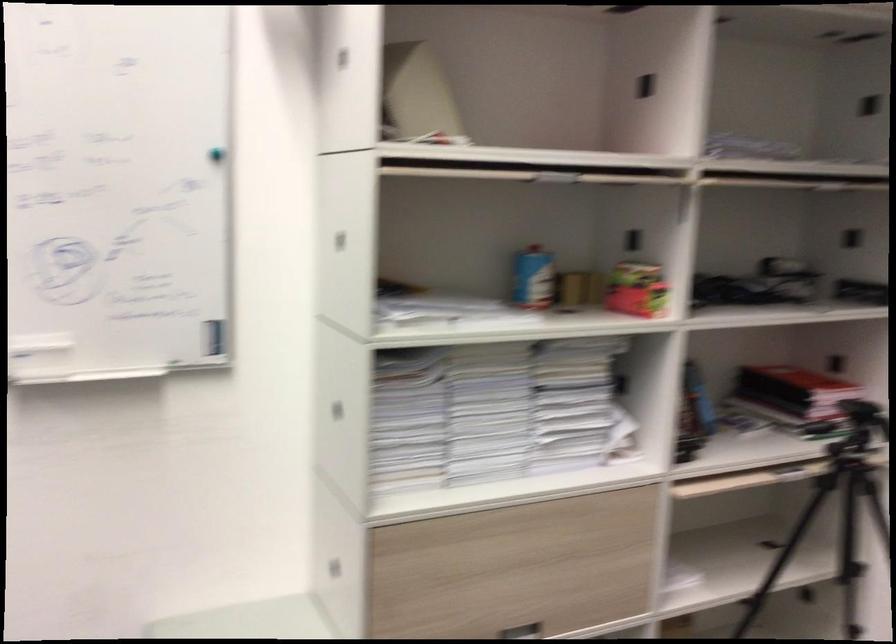
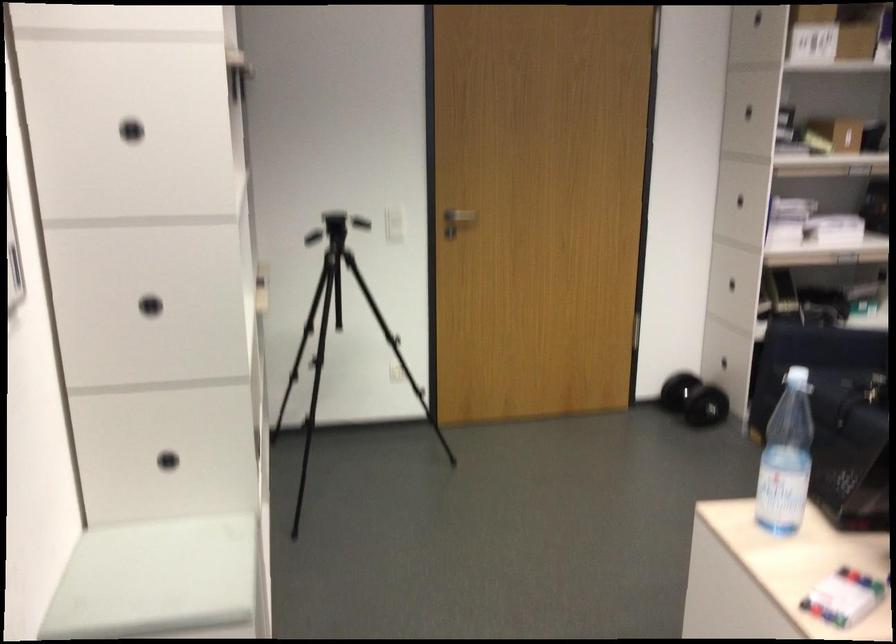
Question: I am providing you with two images of the same scene from different viewpoints. After the viewpoint changes to image2, which objects are now occluded?

Choices:
 (A) white light switch
 (B) stack of red books
 (C) black camera tripod
 (D) fume hood sash

Answer: (B)